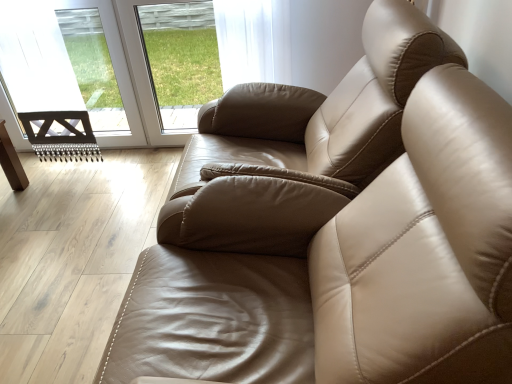
Image resolution: width=512 pixels, height=384 pixels. What do you see at coordinates (132, 73) in the screenshot?
I see `transparent glass door at upper left` at bounding box center [132, 73].

Locate an element on the screen. transparent glass door at upper left is located at coordinates (132, 73).

Is satin beige armchair at center to the left or to the right of transparent glass door at upper left in the image?

satin beige armchair at center is to the right of transparent glass door at upper left.

Which object is further away from the camera, satin beige armchair at center or transparent glass door at upper left?

transparent glass door at upper left is further away from the camera.

Consider the image. Measure the distance from satin beige armchair at center to transparent glass door at upper left.

satin beige armchair at center is 3.90 feet away from transparent glass door at upper left.

Which of these two, satin beige armchair at center or transparent glass door at upper left, stands shorter?

With less height is transparent glass door at upper left.

Which object is more forward, satin beige armchair at center or transparent glass window at upper center?

satin beige armchair at center is in front.

At what (x,y) coordinates should I click in order to perform the action: click on window above the satin beige armchair at center (from the image's perspective). Please return your answer as a coordinate pair (x, y). The image size is (512, 384). Looking at the image, I should click on (181, 59).

Based on the photo, which of these two, satin beige armchair at center or transparent glass window at upper center, stands taller?

satin beige armchair at center.

Is satin beige armchair at center to the left or to the right of transparent glass window at upper center in the image?

Clearly, satin beige armchair at center is on the right of transparent glass window at upper center in the image.

Based on the photo, between transparent glass door at upper left and transparent glass window at upper center, which one has larger size?

Bigger between the two is transparent glass door at upper left.

Can you confirm if transparent glass door at upper left is shorter than transparent glass window at upper center?

Incorrect, the height of transparent glass door at upper left does not fall short of that of transparent glass window at upper center.

Is transparent glass door at upper left oriented towards transparent glass window at upper center?

No.

From the image's perspective, is transparent glass door at upper left located beneath transparent glass window at upper center?

Yes, from the image's perspective, transparent glass door at upper left is beneath transparent glass window at upper center.

How different are the orientations of transparent glass window at upper center and transparent glass door at upper left in degrees?

0.00237 degrees.

Can you confirm if transparent glass window at upper center is wider than transparent glass door at upper left?

In fact, transparent glass window at upper center might be narrower than transparent glass door at upper left.

Is transparent glass window at upper center not close to transparent glass door at upper left?

Actually, transparent glass window at upper center and transparent glass door at upper left are a little close together.

Is transparent glass window at upper center to the right of transparent glass door at upper left from the viewer's perspective?

Yes.

Considering the positions of point (205, 64) and point (228, 225), is point (205, 64) closer or farther from the camera than point (228, 225)?

Point (205, 64) is positioned farther from the camera compared to point (228, 225).

Which is more to the left, transparent glass window at upper center or satin beige armchair at center?

transparent glass window at upper center.

Is transparent glass window at upper center situated inside satin beige armchair at center or outside?

transparent glass window at upper center is spatially situated outside satin beige armchair at center.

From the image's perspective, is transparent glass door at upper left beneath satin beige armchair at center?

No, from the image's perspective, transparent glass door at upper left is not below satin beige armchair at center.

Does transparent glass door at upper left have a greater width compared to satin beige armchair at center?

No, transparent glass door at upper left is not wider than satin beige armchair at center.

Who is smaller, transparent glass door at upper left or satin beige armchair at center?

transparent glass door at upper left is smaller.

Find the location of a particular element. The height and width of the screenshot is (384, 512). armchair to the right of transparent glass door at upper left is located at coordinates (300, 144).

Locate an element on the screen. This screenshot has height=384, width=512. armchair in front of the transparent glass window at upper center is located at coordinates (300, 144).

Considering their positions, is transparent glass window at upper center positioned further to satin beige armchair at center than transparent glass door at upper left?

The object further to satin beige armchair at center is transparent glass window at upper center.

When comparing their distances from satin beige armchair at center, does transparent glass door at upper left or transparent glass window at upper center seem further?

transparent glass window at upper center lies further to satin beige armchair at center than the other object.

Estimate the real-world distances between objects in this image. Which object is closer to transparent glass window at upper center, transparent glass door at upper left or satin beige armchair at center?

transparent glass door at upper left lies closer to transparent glass window at upper center than the other object.

Based on their spatial positions, is satin beige armchair at center or transparent glass window at upper center further from transparent glass door at upper left?

satin beige armchair at center is positioned further to the anchor transparent glass door at upper left.

Based on their spatial positions, is satin beige armchair at center or transparent glass door at upper left further from transparent glass window at upper center?

Based on the image, satin beige armchair at center appears to be further to transparent glass window at upper center.

When comparing their distances from transparent glass door at upper left, does transparent glass window at upper center or satin beige armchair at center seem closer?

The object closer to transparent glass door at upper left is transparent glass window at upper center.

You are a GUI agent. You are given a task and a screenshot of the screen. Output one action in this format:
    pyautogui.click(x=<x>, y=<y>)
    Task: Click on the window located between satin beige armchair at center and transparent glass door at upper left in the depth direction
    This screenshot has width=512, height=384.
    Given the screenshot: What is the action you would take?
    pyautogui.click(x=181, y=59)